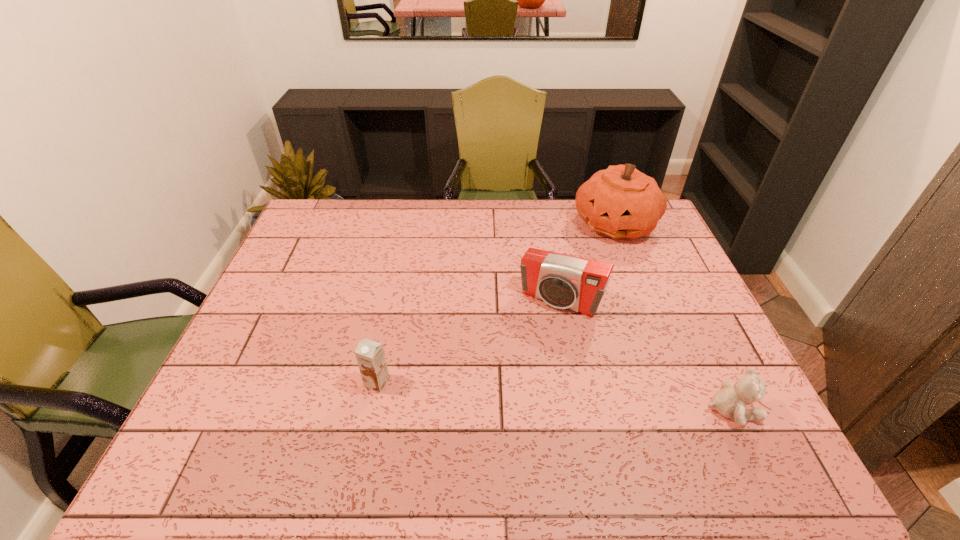
Locate an element on the screen. This screenshot has height=540, width=960. free spot on the desktop that is between the chocolate milk and the teddy bear and is positioned on the front-facing side of the pumpkin is located at coordinates (588, 399).

Where is `free space on the desktop that is between the chocolate milk and the shortest object and is positioned on the front-facing side of the second farthest object`? Image resolution: width=960 pixels, height=540 pixels. free space on the desktop that is between the chocolate milk and the shortest object and is positioned on the front-facing side of the second farthest object is located at coordinates (510, 393).